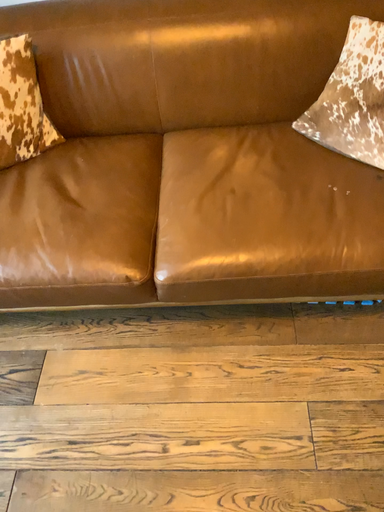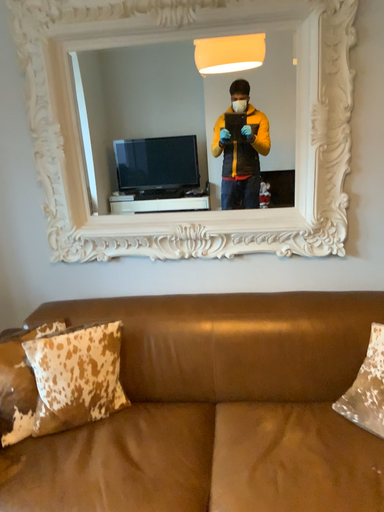
Question: How did the camera likely rotate when shooting the video?

Choices:
 (A) rotated upward
 (B) rotated downward

Answer: (A)